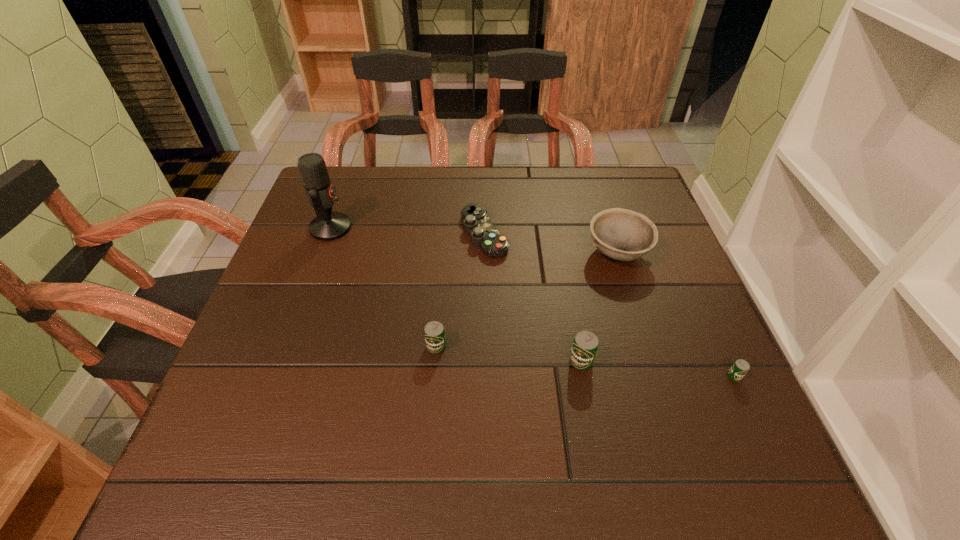
Where is `free spot located on the back of the second beer can from left to right`? free spot located on the back of the second beer can from left to right is located at coordinates (566, 282).

Locate an element on the screen. vacant position located 0.350m on the back of the shortest beer can is located at coordinates (674, 245).

You are a GUI agent. You are given a task and a screenshot of the screen. Output one action in this format:
    pyautogui.click(x=<x>, y=<y>)
    Task: Click on the free space located on the front of the control
    
    Given the screenshot: What is the action you would take?
    (x=485, y=337)

This screenshot has height=540, width=960. What are the coordinates of `free space located on the side of the microphone with the red ring` in the screenshot? It's located at (493, 227).

This screenshot has height=540, width=960. I want to click on free space located 0.300m on the left of the bowl, so click(x=462, y=253).

Identify the location of control that is at the far edge. (476, 223).

This screenshot has width=960, height=540. I want to click on microphone that is positioned at the far edge, so click(328, 225).

This screenshot has height=540, width=960. In order to click on object that is at the left edge in this screenshot , I will do `click(328, 225)`.

Locate an element on the screen. The width and height of the screenshot is (960, 540). beer can that is at the right edge is located at coordinates (739, 369).

The width and height of the screenshot is (960, 540). Identify the location of bowl that is at the right edge. [620, 234].